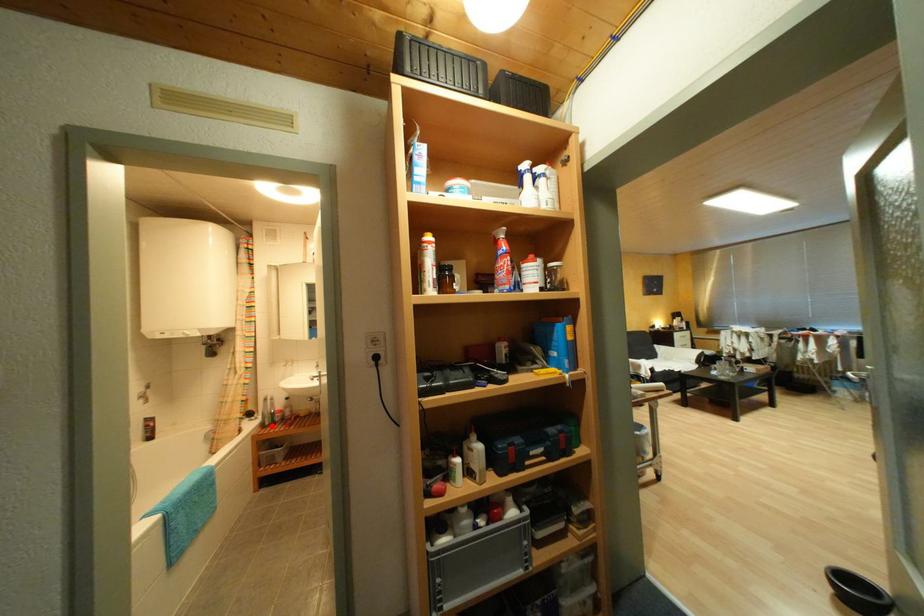
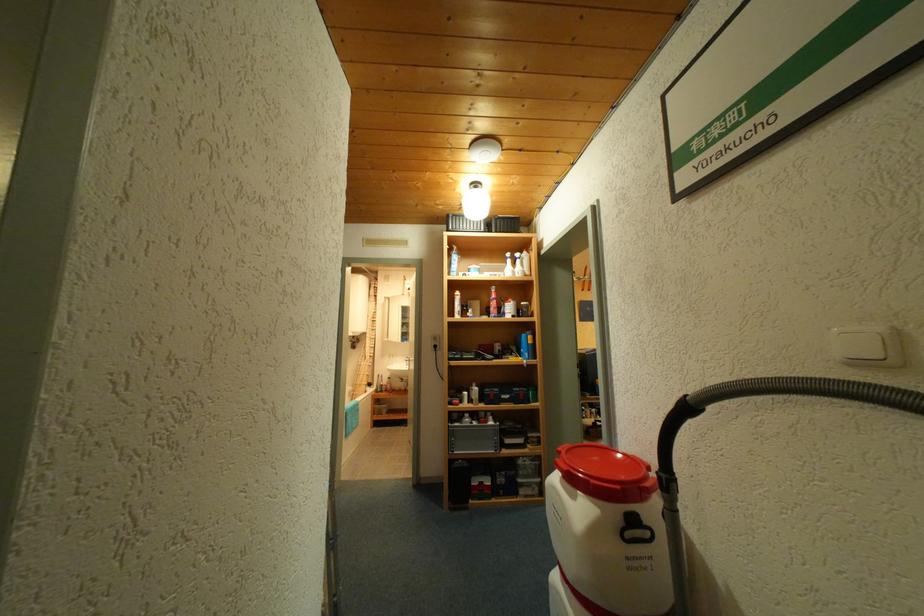
Question: I am providing you with two images of the same scene from different viewpoints. A red point is marked on the first image. At the location where the point appears in image 1, is it still visible in image 2?

Choices:
 (A) Yes
 (B) No

Answer: (A)